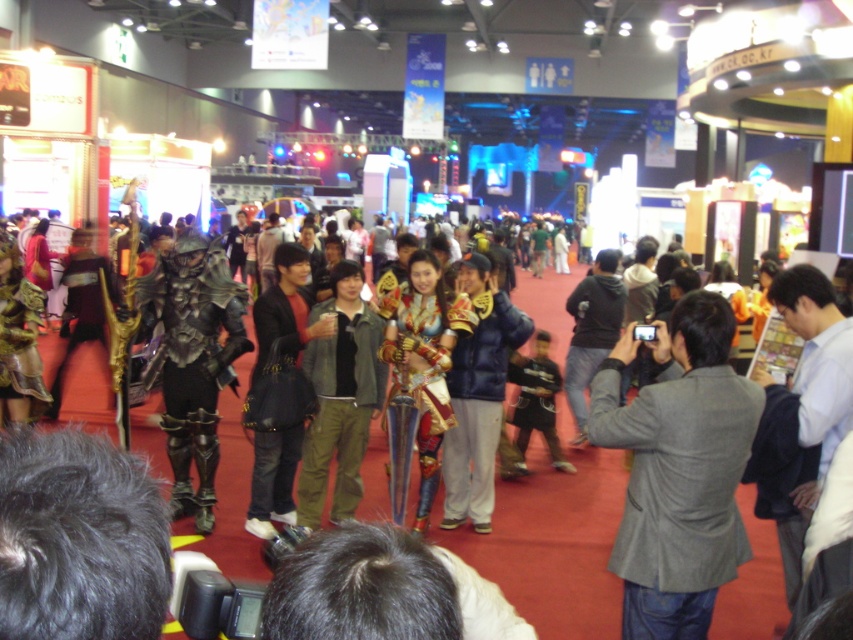
Is green matte jacket at center shorter than velvet gold armor at center?

Yes, green matte jacket at center is shorter than velvet gold armor at center.

Is green matte jacket at center to the left of velvet gold armor at center from the viewer's perspective?

→ Indeed, green matte jacket at center is positioned on the left side of velvet gold armor at center.

Measure the distance between green matte jacket at center and camera.

18.17 feet

Find the location of a particular element. The height and width of the screenshot is (640, 853). green matte jacket at center is located at coordinates (340, 397).

What do you see at coordinates (552, 544) in the screenshot?
I see `metallic armor at center` at bounding box center [552, 544].

Is metallic armor at center to the right of gray wool jacket at center from the viewer's perspective?

In fact, metallic armor at center is to the left of gray wool jacket at center.

What do you see at coordinates (552, 544) in the screenshot? I see `metallic armor at center` at bounding box center [552, 544].

Where is `metallic armor at center`? The height and width of the screenshot is (640, 853). metallic armor at center is located at coordinates (552, 544).

Is shiny metallic armor at center above gold metallic armor at center?

Correct, shiny metallic armor at center is located above gold metallic armor at center.

Between shiny metallic armor at center and gold metallic armor at center, which one appears on the left side from the viewer's perspective?

Positioned to the left is shiny metallic armor at center.

Is point (228, 356) positioned in front of point (424, 317)?

No, it is not.

Where is `shiny metallic armor at center`? This screenshot has height=640, width=853. shiny metallic armor at center is located at coordinates (192, 360).